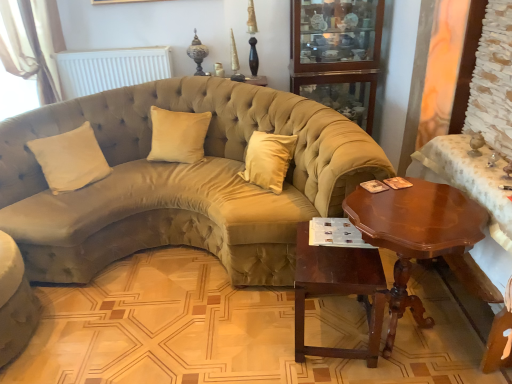
Locate an element on the screen. This screenshot has width=512, height=384. vacant area that lies between mahogany wood table at lower center and shiny brown wood coffee table at right is located at coordinates (325, 370).